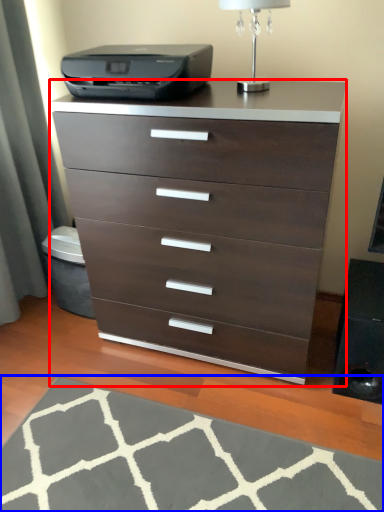
Question: Which point is closer to the camera, chest of drawers (highlighted by a red box) or doormat (highlighted by a blue box)?

Choices:
 (A) chest of drawers
 (B) doormat

Answer: (B)